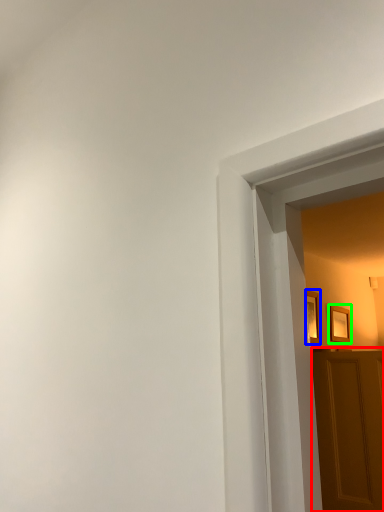
Question: Based on their relative distances, which object is farther from door (highlighted by a red box)? Choose from picture frame (highlighted by a blue box) and picture frame (highlighted by a green box).

Choices:
 (A) picture frame
 (B) picture frame

Answer: (B)